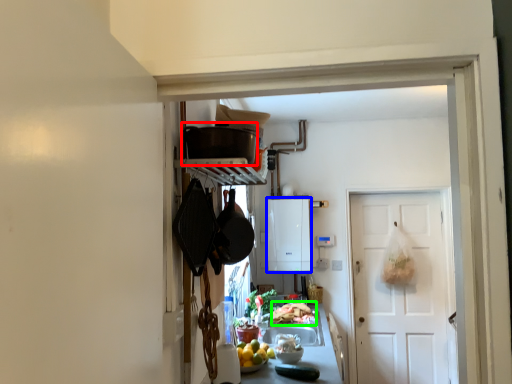
Question: Considering the real-world distances, which object is farthest from appliance (highlighted by a red box)? appliance (highlighted by a blue box) or food (highlighted by a green box)?

Choices:
 (A) appliance
 (B) food

Answer: (A)